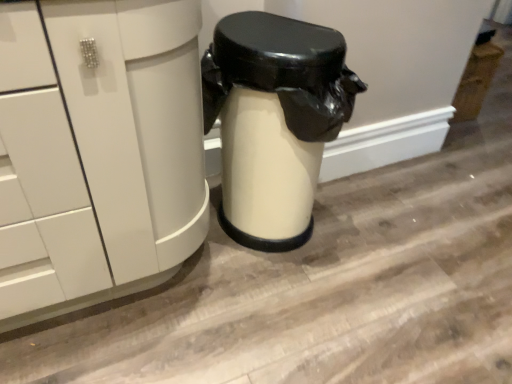
Question: Can you confirm if white glossy cabinet at left is smaller than white glossy trash can at center?

Choices:
 (A) yes
 (B) no

Answer: (B)

Question: Is white glossy cabinet at left positioned with its back to white glossy trash can at center?

Choices:
 (A) no
 (B) yes

Answer: (A)

Question: Can white glossy trash can at center be found inside white glossy cabinet at left?

Choices:
 (A) yes
 (B) no

Answer: (B)

Question: Can you confirm if white glossy cabinet at left is bigger than white glossy trash can at center?

Choices:
 (A) no
 (B) yes

Answer: (B)

Question: Can you confirm if white glossy cabinet at left is shorter than white glossy trash can at center?

Choices:
 (A) yes
 (B) no

Answer: (B)

Question: From the image's perspective, is white glossy cabinet at left over white glossy trash can at center?

Choices:
 (A) yes
 (B) no

Answer: (B)

Question: Considering the relative sizes of white glossy trash can at center and white glossy cabinet at left in the image provided, is white glossy trash can at center shorter than white glossy cabinet at left?

Choices:
 (A) no
 (B) yes

Answer: (B)

Question: Is white glossy trash can at center at the left side of white glossy cabinet at left?

Choices:
 (A) no
 (B) yes

Answer: (A)

Question: Does white glossy trash can at center have a greater height compared to white glossy cabinet at left?

Choices:
 (A) yes
 (B) no

Answer: (B)

Question: Is white glossy trash can at center to the right of white glossy cabinet at left from the viewer's perspective?

Choices:
 (A) yes
 (B) no

Answer: (A)

Question: Is white glossy trash can at center closer to the viewer compared to white glossy cabinet at left?

Choices:
 (A) no
 (B) yes

Answer: (A)

Question: From the image's perspective, is white glossy trash can at center located above white glossy cabinet at left?

Choices:
 (A) yes
 (B) no

Answer: (A)

Question: Relative to white glossy cabinet at left, is white glossy trash can at center in front or behind?

Choices:
 (A) behind
 (B) front

Answer: (A)